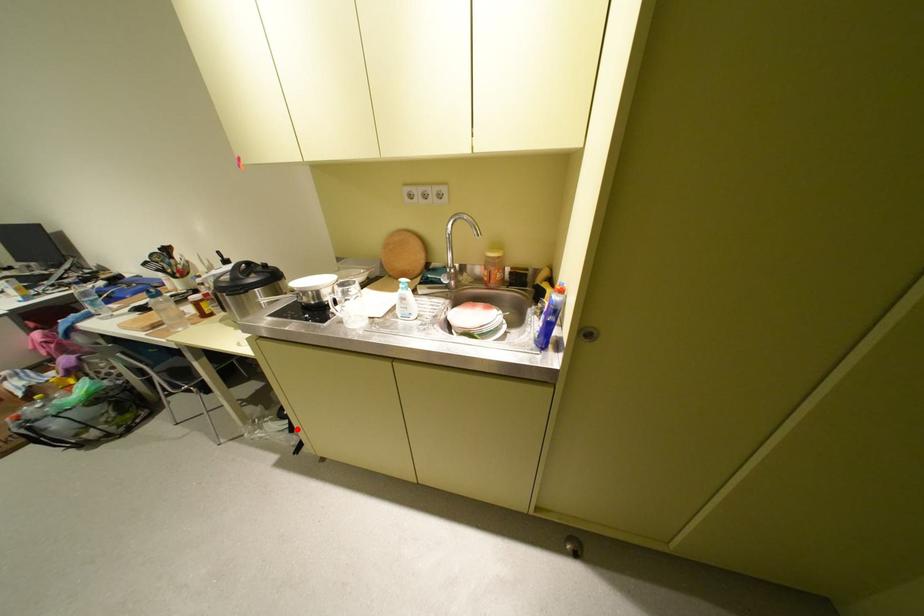
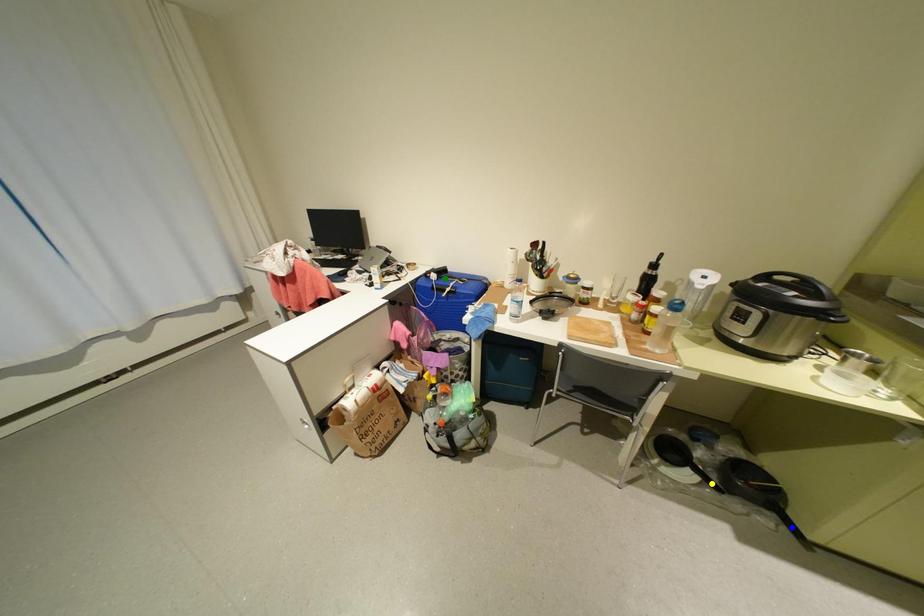
Question: I am providing you with two images of the same scene from different viewpoints. A red point is marked on the first image. You are given multiple points on the second image. Which point in image 2 represents the same 3d spot as the red point in image 1?

Choices:
 (A) blue point
 (B) green point
 (C) yellow point

Answer: (C)